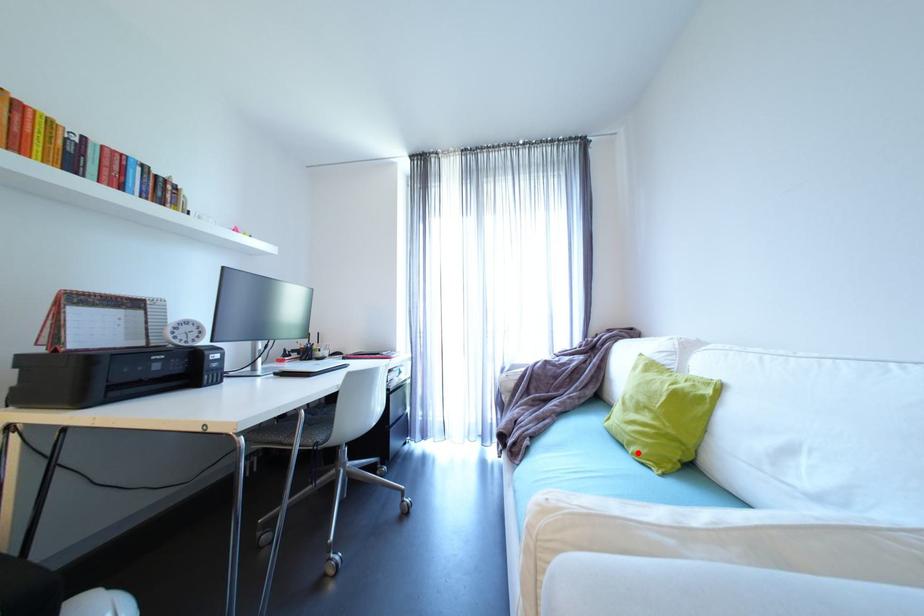
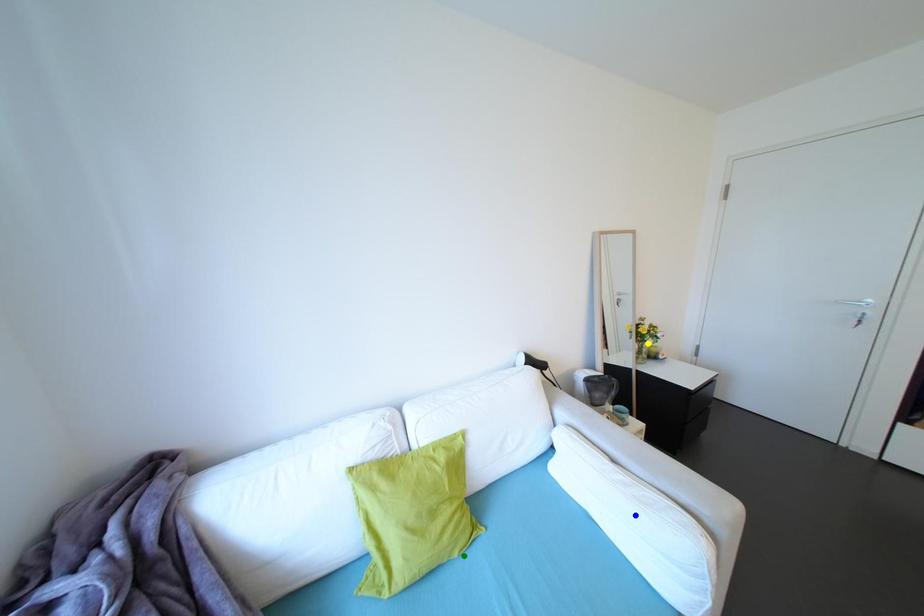
Question: I am providing you with two images of the same scene from different viewpoints. A red point is marked on the first image. You are given multiple points on the second image. Which point in image 2 is actually the same real-world point as the red point in image 1?

Choices:
 (A) green point
 (B) blue point
 (C) yellow point

Answer: (A)